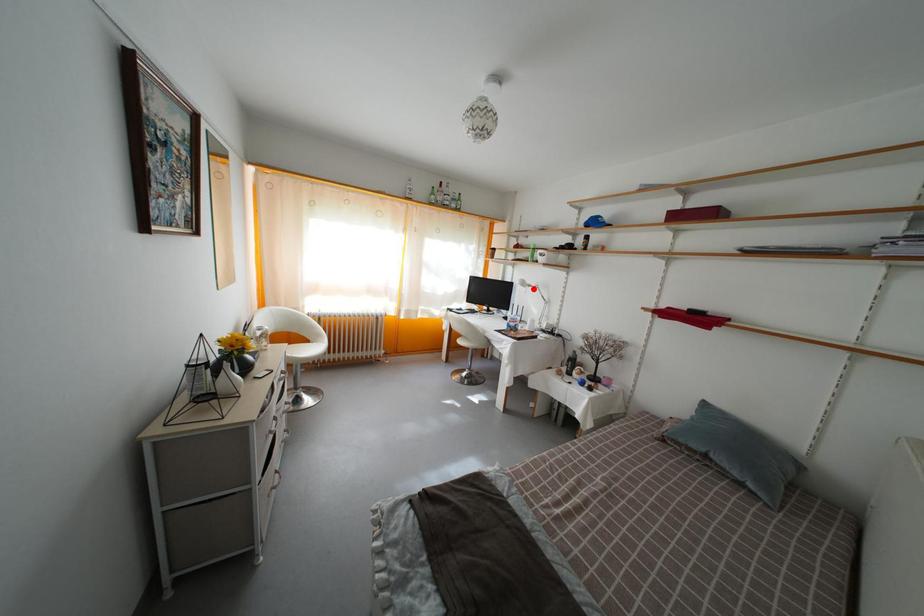
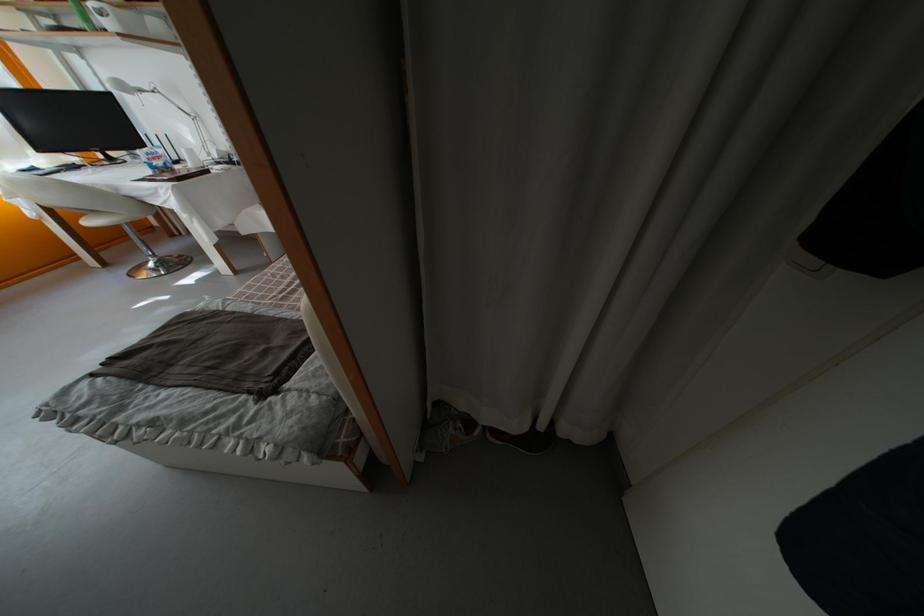
Question: A red point is marked in image1. In image2, is the corresponding 3D point closer to the camera or farther? Reply with the corresponding letter.

Choices:
 (A) The corresponding 3D point is closer.
 (B) The corresponding 3D point is farther.

Answer: (B)